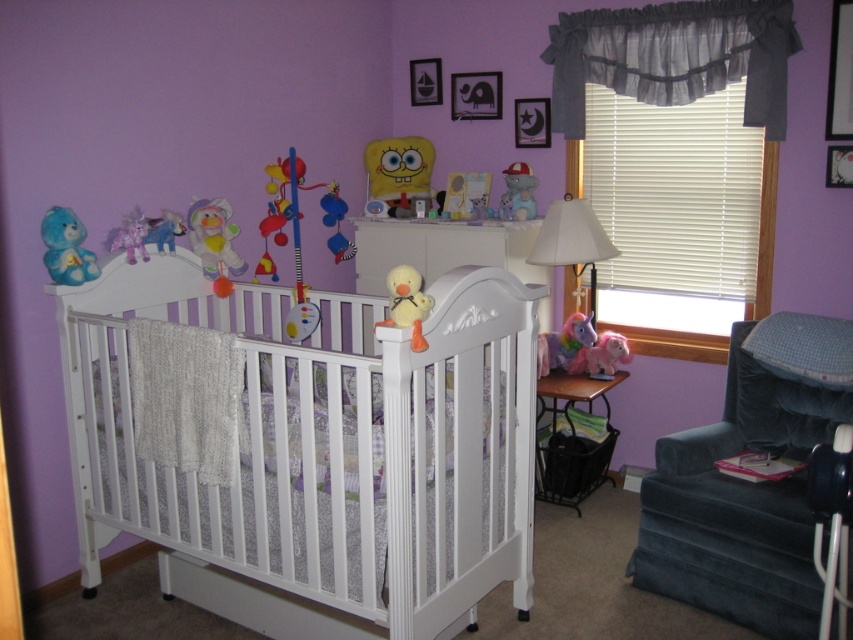
Can you confirm if blue plush bear at left is smaller than matte plastic elephant at center?

Correct, blue plush bear at left occupies less space than matte plastic elephant at center.

Is blue plush bear at left bigger than matte plastic elephant at center?

No, blue plush bear at left is not bigger than matte plastic elephant at center.

Does point (68, 253) come farther from viewer compared to point (518, 184)?

That is False.

The width and height of the screenshot is (853, 640). What are the coordinates of `blue plush bear at left` in the screenshot? It's located at (67, 248).

Identify the location of gray fabric valance at upper right. (674, 56).

You are a GUI agent. You are given a task and a screenshot of the screen. Output one action in this format:
    pyautogui.click(x=<x>, y=<y>)
    Task: Click on the gray fabric valance at upper right
    
    Given the screenshot: What is the action you would take?
    pyautogui.click(x=674, y=56)

Can you confirm if black paper picture frame at upper center is positioned to the right of plush rainbow unicorn at center?

Incorrect, black paper picture frame at upper center is not on the right side of plush rainbow unicorn at center.

Measure the distance between black paper picture frame at upper center and plush rainbow unicorn at center.

A distance of 3.70 feet exists between black paper picture frame at upper center and plush rainbow unicorn at center.

Is point (457, 116) less distant than point (570, 356)?

No, (457, 116) is behind (570, 356).

This screenshot has width=853, height=640. I want to click on black paper picture frame at upper center, so click(x=474, y=96).